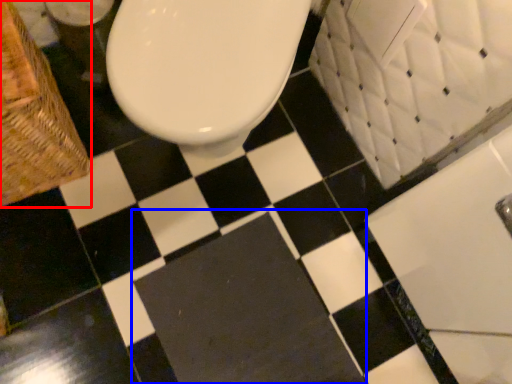
Question: Which object appears closest to the camera in this image, basket (highlighted by a red box) or bath mat (highlighted by a blue box)?

Choices:
 (A) basket
 (B) bath mat

Answer: (A)